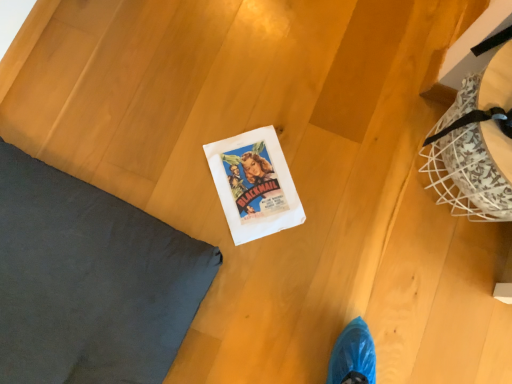
You are a GUI agent. You are given a task and a screenshot of the screen. Output one action in this format:
    pyautogui.click(x=<x>, y=<y>)
    Task: Click on the free spot to the right of dark gray fabric pillow at upper left
    
    Given the screenshot: What is the action you would take?
    pyautogui.click(x=286, y=281)